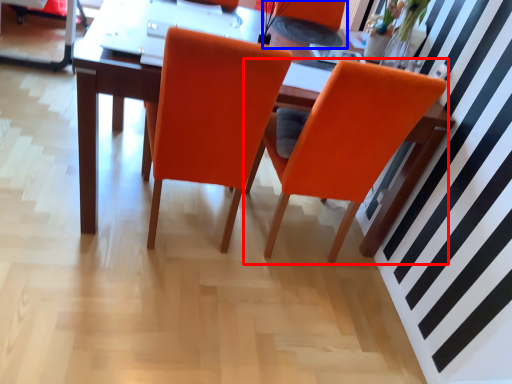
Question: Which object appears farthest to the camera in this image, chair (highlighted by a red box) or armchair (highlighted by a blue box)?

Choices:
 (A) chair
 (B) armchair

Answer: (B)